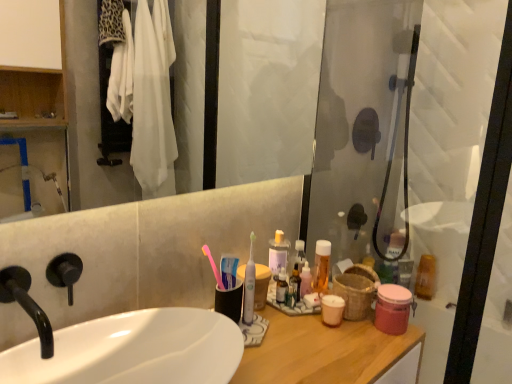
This screenshot has height=384, width=512. What do you see at coordinates (249, 286) in the screenshot? I see `white plastic toothbrush at center, the 1th toothbrush viewed from the right` at bounding box center [249, 286].

What is the approximate height of translucent plastic mouthwash at center, acting as the 1th mouthwash starting from the left?

It is 5.47 inches.

Measure the distance between point (322, 286) and camera.

The depth of point (322, 286) is 4.27 feet.

Identify the location of white glossy sink at center. (121, 345).

How much space does pink plastic toothbrush at center, marked as the 2th toothbrush in a right-to-left arrangement, occupy vertically?

pink plastic toothbrush at center, marked as the 2th toothbrush in a right-to-left arrangement, is 6.39 inches in height.

What do you see at coordinates (396, 244) in the screenshot? I see `translucent plastic mouthwash at upper right, which is the first mouthwash in back-to-front order` at bounding box center [396, 244].

Find the location of `translucent plastic mouthwash at upper right, the 2th mouthwash from the right`. translucent plastic mouthwash at upper right, the 2th mouthwash from the right is located at coordinates (396, 244).

Find the location of `white plastic toothbrush at center, the 1th toothbrush viewed from the right`. white plastic toothbrush at center, the 1th toothbrush viewed from the right is located at coordinates (249, 286).

Is point (319, 269) positioned behind point (346, 12)?

No, (319, 269) is in front of (346, 12).

Is translucent plastic mouthwash at center, the 4th mouthwash viewed from the right, not near transparent glass shower door at right?

No, translucent plastic mouthwash at center, the 4th mouthwash viewed from the right, is in close proximity to transparent glass shower door at right.

How many degrees apart are the facing directions of translucent plastic mouthwash at center, placed as the 2th mouthwash when sorted from front to back, and transparent glass shower door at right?

There is a 85.5-degree angle between the facing directions of translucent plastic mouthwash at center, placed as the 2th mouthwash when sorted from front to back, and transparent glass shower door at right.

Could you measure the distance between black matte faucet at left and translucent plastic mouthwash at upper right, arranged as the third mouthwash when viewed from the front?

They are 1.53 meters apart.

Considering the positions of point (45, 315) and point (416, 292), is point (45, 315) closer or farther from the camera than point (416, 292)?

Clearly, point (45, 315) is closer to the camera than point (416, 292).

From a real-world perspective, is black matte faucet at left physically below translucent plastic mouthwash at upper right, the 1th mouthwash positioned from the right?

No, from a real-world perspective, black matte faucet at left is not under translucent plastic mouthwash at upper right, the 1th mouthwash positioned from the right.

Does black matte faucet at left have a lesser height compared to translucent plastic mouthwash at upper right, the fourth mouthwash from the left?

Yes, black matte faucet at left is shorter than translucent plastic mouthwash at upper right, the fourth mouthwash from the left.

Considering the relative sizes of pink matte jar at right, arranged as the first mouthwash when viewed from the front, and translucent plastic mouthwash at upper right, which is the first mouthwash in back-to-front order, in the image provided, is pink matte jar at right, arranged as the first mouthwash when viewed from the front, shorter than translucent plastic mouthwash at upper right, which is the first mouthwash in back-to-front order,?

Yes.

Could you tell me if pink matte jar at right, acting as the 3th mouthwash starting from the right, is turned towards translucent plastic mouthwash at upper right, arranged as the third mouthwash when viewed from the left?

No, pink matte jar at right, acting as the 3th mouthwash starting from the right, is not facing towards translucent plastic mouthwash at upper right, arranged as the third mouthwash when viewed from the left.

Considering the relative positions of pink matte jar at right, arranged as the first mouthwash when viewed from the front, and translucent plastic mouthwash at upper right, which appears as the 4th mouthwash when viewed from the front, in the image provided, is pink matte jar at right, arranged as the first mouthwash when viewed from the front, to the left or to the right of translucent plastic mouthwash at upper right, which appears as the 4th mouthwash when viewed from the front,?

In the image, pink matte jar at right, arranged as the first mouthwash when viewed from the front, appears on the left side of translucent plastic mouthwash at upper right, which appears as the 4th mouthwash when viewed from the front.

Is point (386, 321) behind point (383, 280)?

No, (386, 321) is closer to viewer.

Considering the sizes of objects transparent glass shower door at right and white plastic toothbrush at center, arranged as the second toothbrush when viewed from the left, in the image provided, who is taller, transparent glass shower door at right or white plastic toothbrush at center, arranged as the second toothbrush when viewed from the left,?

With more height is transparent glass shower door at right.

From a real-world perspective, who is located higher, transparent glass shower door at right or white plastic toothbrush at center, arranged as the second toothbrush when viewed from the left?

In real-world perspective, transparent glass shower door at right is above.

Which is farther from the camera, (333, 106) or (253, 315)?

The point (333, 106) is behind.

Is white plastic toothbrush at center, arranged as the second toothbrush when viewed from the left, located within transparent glass shower door at right?

No, white plastic toothbrush at center, arranged as the second toothbrush when viewed from the left, is located outside of transparent glass shower door at right.

Can you confirm if black matte faucet at left is shorter than translucent plastic mouthwash at center, placed as the 2th mouthwash when sorted from front to back?

Indeed, black matte faucet at left has a lesser height compared to translucent plastic mouthwash at center, placed as the 2th mouthwash when sorted from front to back.

Is black matte faucet at left not inside translucent plastic mouthwash at center, placed as the 2th mouthwash when sorted from front to back?

Yes, black matte faucet at left is outside of translucent plastic mouthwash at center, placed as the 2th mouthwash when sorted from front to back.

From the image's perspective, is black matte faucet at left over translucent plastic mouthwash at center, acting as the 1th mouthwash starting from the left?

Yes.

Can you confirm if translucent plastic mouthwash at center, placed as the 2th mouthwash when sorted from front to back, is bigger than white glossy sink at center?

Incorrect, translucent plastic mouthwash at center, placed as the 2th mouthwash when sorted from front to back, is not larger than white glossy sink at center.

Locate an element on the screen. sink in front of the translucent plastic mouthwash at center, the 4th mouthwash viewed from the right is located at coordinates 121,345.

From their relative heights in the image, would you say translucent plastic mouthwash at center, placed as the 2th mouthwash when sorted from front to back, is taller or shorter than white glossy sink at center?

In the image, translucent plastic mouthwash at center, placed as the 2th mouthwash when sorted from front to back, appears to be taller than white glossy sink at center.

Based on the photo, between translucent plastic mouthwash at center, the 4th mouthwash viewed from the right, and white glossy sink at center, which one is positioned in front?

white glossy sink at center.

Between pink plastic toothbrush at center, marked as the 2th toothbrush in a right-to-left arrangement, and translucent plastic mouthwash at upper right, arranged as the third mouthwash when viewed from the front, which one appears on the left side from the viewer's perspective?

pink plastic toothbrush at center, marked as the 2th toothbrush in a right-to-left arrangement, is more to the left.

Is pink plastic toothbrush at center, marked as the 2th toothbrush in a right-to-left arrangement, directly adjacent to translucent plastic mouthwash at upper right, the second mouthwash viewed from the back?

No, pink plastic toothbrush at center, marked as the 2th toothbrush in a right-to-left arrangement, is not in contact with translucent plastic mouthwash at upper right, the second mouthwash viewed from the back.

From the image's perspective, does pink plastic toothbrush at center, the 1th toothbrush from the left, appear lower than translucent plastic mouthwash at upper right, the second mouthwash viewed from the back?

No.

From a real-world perspective, between pink plastic toothbrush at center, the 1th toothbrush from the left, and translucent plastic mouthwash at upper right, the fourth mouthwash from the left, who is vertically lower?

In real-world perspective, translucent plastic mouthwash at upper right, the fourth mouthwash from the left, is lower.

This screenshot has height=384, width=512. I want to click on mouthwash that is the 2nd one when counting leftward from the transparent glass shower door at right, so click(322, 266).

At what (x,y) coordinates should I click in order to perform the action: click on tap located above the translucent plastic mouthwash at upper right, the fourth mouthwash from the left (from the image's perspective). Please return your answer as a coordinate pair (x, y). This screenshot has width=512, height=384. Looking at the image, I should click on (26, 304).

From the image, which object appears to be nearer to white glossy sink at center, translucent plastic mouthwash at upper right, arranged as the third mouthwash when viewed from the front, or translucent plastic mouthwash at upper right, arranged as the third mouthwash when viewed from the left?

translucent plastic mouthwash at upper right, arranged as the third mouthwash when viewed from the left, lies closer to white glossy sink at center than the other object.

Based on the photo, based on their spatial positions, is translucent plastic mouthwash at upper right, which is the first mouthwash in back-to-front order, or transparent glass shower door at right further from pink plastic toothbrush at center, marked as the 2th toothbrush in a right-to-left arrangement?

The object further to pink plastic toothbrush at center, marked as the 2th toothbrush in a right-to-left arrangement, is translucent plastic mouthwash at upper right, which is the first mouthwash in back-to-front order.

Looking at the image, which one is located further to white glossy sink at center, black matte faucet at left or transparent glass shower door at right?

The object further to white glossy sink at center is transparent glass shower door at right.

From the image, which object appears to be nearer to pink matte jar at right, the fourth mouthwash viewed from the back, pink plastic toothbrush at center, marked as the 2th toothbrush in a right-to-left arrangement, or black matte faucet at left?

pink plastic toothbrush at center, marked as the 2th toothbrush in a right-to-left arrangement, is positioned closer to the anchor pink matte jar at right, the fourth mouthwash viewed from the back.

Considering their positions, is pink plastic toothbrush at center, the 1th toothbrush from the left, positioned further to translucent plastic mouthwash at upper right, which appears as the 4th mouthwash when viewed from the front, than white plastic toothbrush at center, the 1th toothbrush viewed from the right?

Based on the image, pink plastic toothbrush at center, the 1th toothbrush from the left, appears to be further to translucent plastic mouthwash at upper right, which appears as the 4th mouthwash when viewed from the front.

Looking at the image, which one is located further to white glossy sink at center, pink plastic toothbrush at center, marked as the 2th toothbrush in a right-to-left arrangement, or transparent glass shower door at right?

transparent glass shower door at right is further to white glossy sink at center.

Looking at the image, which one is located further to transparent glass shower door at right, translucent plastic mouthwash at center, the 4th mouthwash viewed from the right, or white glossy sink at center?

white glossy sink at center is positioned further to the anchor transparent glass shower door at right.

Based on their spatial positions, is white plastic toothbrush at center, the 1th toothbrush viewed from the right, or pink matte jar at right, the second mouthwash viewed from the left, closer to black matte faucet at left?

white plastic toothbrush at center, the 1th toothbrush viewed from the right, is closer to black matte faucet at left.

Locate an element on the screen. mouthwash between pink matte jar at right, the fourth mouthwash viewed from the back, and translucent plastic mouthwash at upper right, the 1th mouthwash positioned from the right, along the z-axis is located at coordinates (322, 266).

At what (x,y) coordinates should I click in order to perform the action: click on toothbrush located between pink plastic toothbrush at center, marked as the 2th toothbrush in a right-to-left arrangement, and translucent plastic mouthwash at center, placed as the 2th mouthwash when sorted from front to back, in the left-right direction. Please return your answer as a coordinate pair (x, y). Looking at the image, I should click on (249, 286).

You are a GUI agent. You are given a task and a screenshot of the screen. Output one action in this format:
    pyautogui.click(x=<x>, y=<y>)
    Task: Click on the mouthwash between black matte faucet at left and pink matte jar at right, the fourth mouthwash viewed from the back, from left to right
    The height and width of the screenshot is (384, 512).
    Given the screenshot: What is the action you would take?
    pyautogui.click(x=322, y=266)

The height and width of the screenshot is (384, 512). I want to click on screen door between black matte faucet at left and translucent plastic mouthwash at upper right, arranged as the third mouthwash when viewed from the left, in the front-back direction, so click(x=418, y=151).